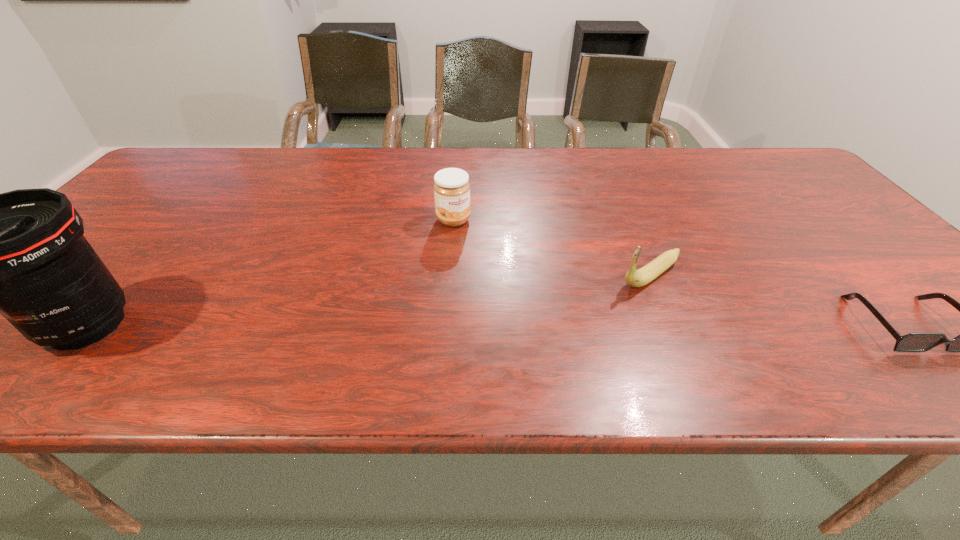
Locate an element on the screen. The height and width of the screenshot is (540, 960). object located at the near edge is located at coordinates point(22,253).

What are the coordinates of `object located at the left edge` in the screenshot? It's located at (22, 253).

Where is `object located at the near left corner`? This screenshot has height=540, width=960. object located at the near left corner is located at coordinates (22, 253).

Where is `free location at the far edge of the desktop`? The image size is (960, 540). free location at the far edge of the desktop is located at coordinates (334, 158).

Where is `vacant area at the near edge of the desktop`? This screenshot has width=960, height=540. vacant area at the near edge of the desktop is located at coordinates (452, 340).

The height and width of the screenshot is (540, 960). Find the location of `vacant space at the left edge of the desktop`. vacant space at the left edge of the desktop is located at coordinates (116, 277).

In the image, there is a desktop. Where is `free space at the far left corner`? free space at the far left corner is located at coordinates (195, 147).

Find the location of `free region at the far right corner of the desktop`. free region at the far right corner of the desktop is located at coordinates (758, 178).

Find the location of a particular element. free space between the third object from left to right and the telephoto lens is located at coordinates (369, 300).

Where is `free spot between the banana and the leftmost object`? This screenshot has height=540, width=960. free spot between the banana and the leftmost object is located at coordinates pyautogui.click(x=369, y=300).